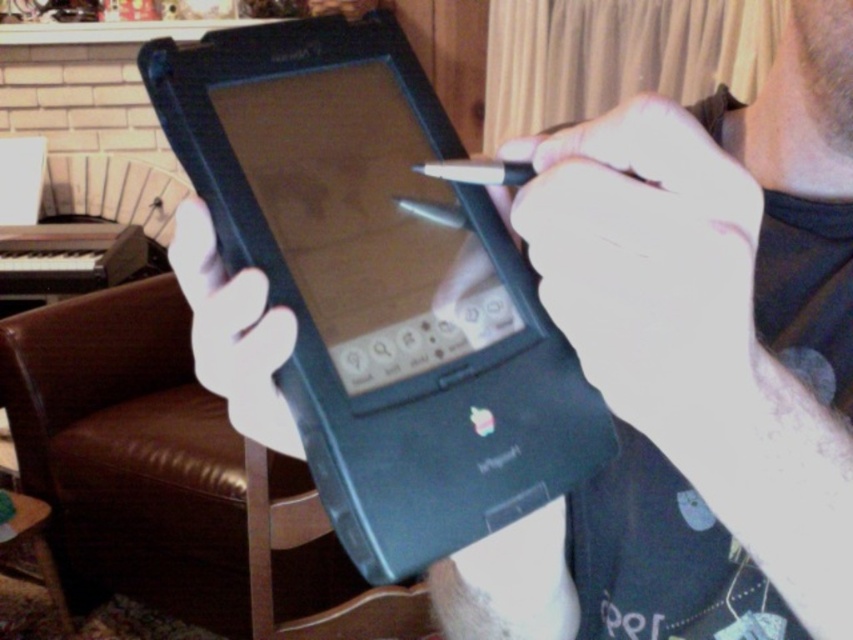
You are an artist who needs to use the white matte pen at upper center. You see the white matte hand at center reaching towards it. Will the hand be able to grab the pen without moving its current position?

The white matte pen at upper center is closer to the viewer than the white matte hand at center, so the hand would need to move forward to reach the pen.

You are an interior designer working on a project and need to place a new decorative item exactly where the white matte pen at upper center is located. According to the image, what are the coordinates of the point where you should place the new item?

The coordinates for the white matte pen at upper center are at point (648, 262).